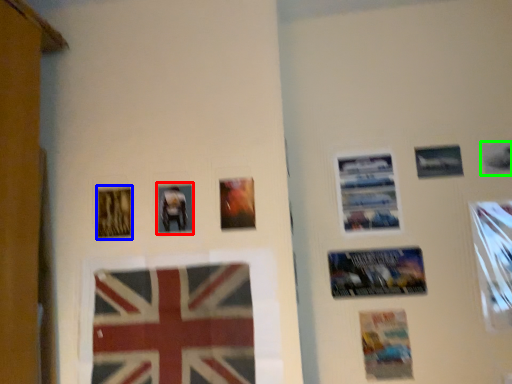
Question: Based on their relative distances, which object is farther from picture frame (highlighted by a red box)? Choose from picture frame (highlighted by a blue box) and picture frame (highlighted by a green box).

Choices:
 (A) picture frame
 (B) picture frame

Answer: (B)